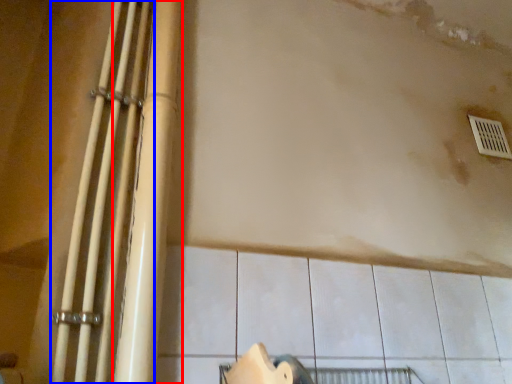
Question: Among these objects, which one is nearest to the camera, beam (highlighted by a red box) or beam (highlighted by a blue box)?

Choices:
 (A) beam
 (B) beam

Answer: (B)